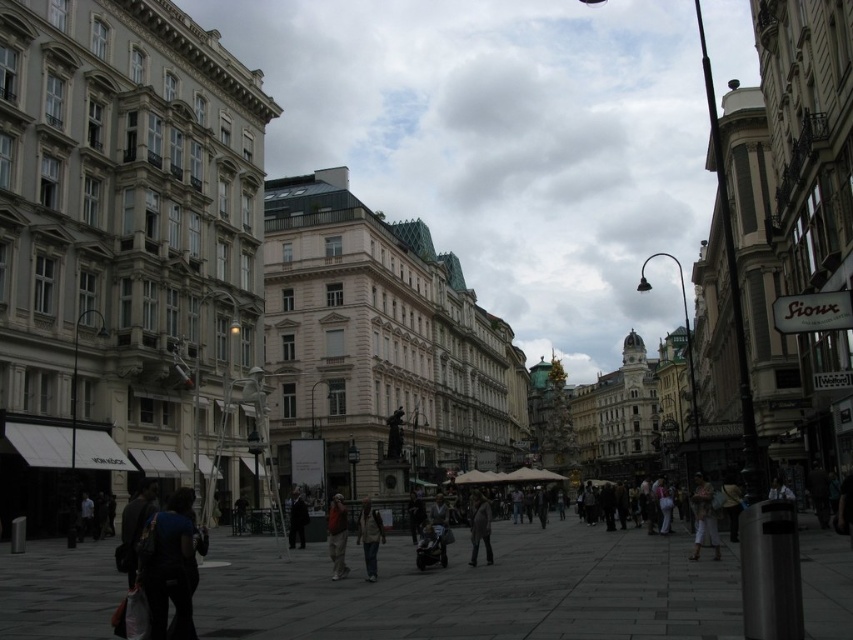
Where is `light pink fabric pants at lower right`? This screenshot has height=640, width=853. light pink fabric pants at lower right is located at coordinates (703, 516).

Does light pink fabric pants at lower right appear on the left side of khaki fabric jacket at center?

No, light pink fabric pants at lower right is not to the left of khaki fabric jacket at center.

In order to click on light pink fabric pants at lower right in this screenshot , I will do `click(703, 516)`.

Where is `light pink fabric pants at lower right`? Image resolution: width=853 pixels, height=640 pixels. light pink fabric pants at lower right is located at coordinates (703, 516).

Is dark blue fabric at lower left above brown textured coat at center?

Yes.

Does dark blue fabric at lower left have a larger size compared to brown textured coat at center?

Incorrect, dark blue fabric at lower left is not larger than brown textured coat at center.

What do you see at coordinates (170, 566) in the screenshot? The width and height of the screenshot is (853, 640). I see `dark blue fabric at lower left` at bounding box center [170, 566].

You are a GUI agent. You are given a task and a screenshot of the screen. Output one action in this format:
    pyautogui.click(x=<x>, y=<y>)
    Task: Click on the dark blue fabric at lower left
    
    Given the screenshot: What is the action you would take?
    pyautogui.click(x=170, y=566)

Is dark blue fabric at lower left smaller than light pink fabric pants at lower right?

Yes, dark blue fabric at lower left is smaller than light pink fabric pants at lower right.

Locate an element on the screen. This screenshot has width=853, height=640. dark blue fabric at lower left is located at coordinates (170, 566).